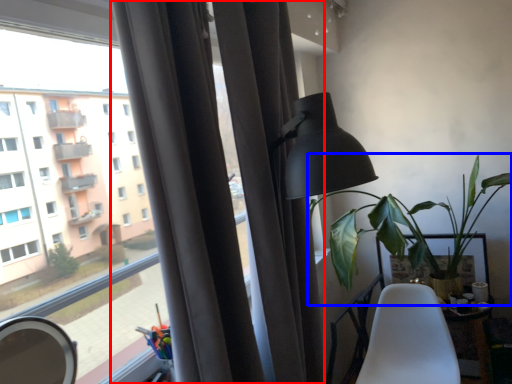
Question: Which object is closer to the camera taking this photo, curtain (highlighted by a red box) or houseplant (highlighted by a blue box)?

Choices:
 (A) curtain
 (B) houseplant

Answer: (A)